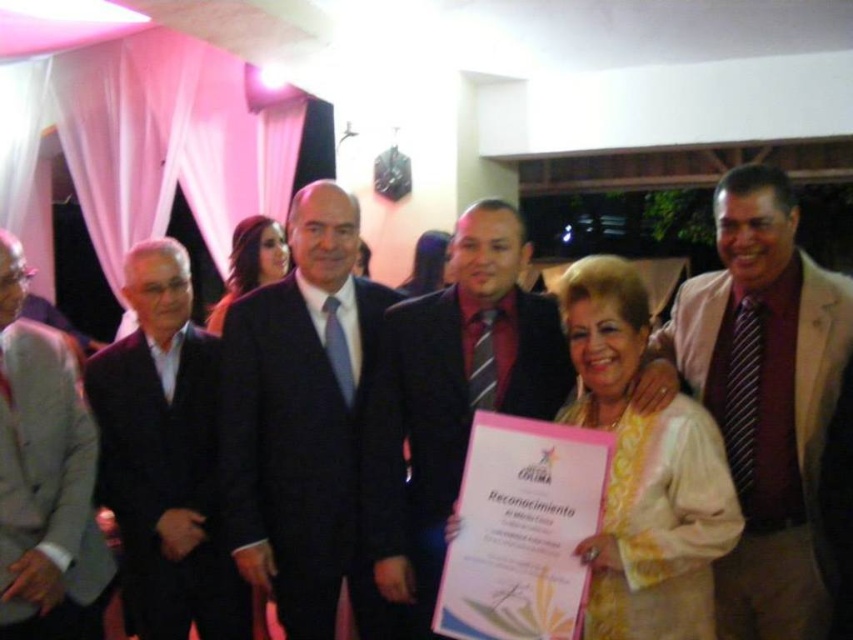
You are standing in the banquet hall and notice two points marked in the image. Which point is closer to you, point (x=219, y=314) or point (x=415, y=296)?

Point (x=219, y=314) is closer to the viewer than point (x=415, y=296).

You are a photographer at the event and want to ensure that the shiny dark hair at center and the matte gold necklace at center are both visible in the photo. Based on their positions, which object should you focus on first to capture both effectively?

The shiny dark hair at center is located below the matte gold necklace at center. To capture both effectively, focus on the matte gold necklace at center first as it is higher up, ensuring the lower shiny dark hair at center remains in frame.